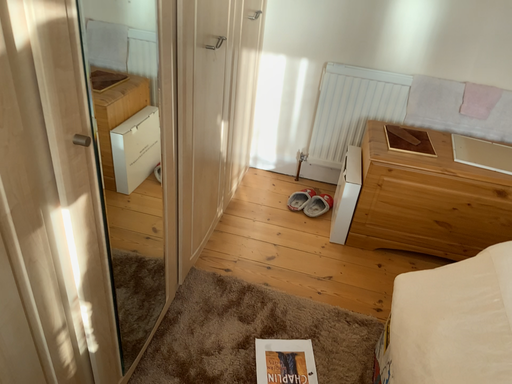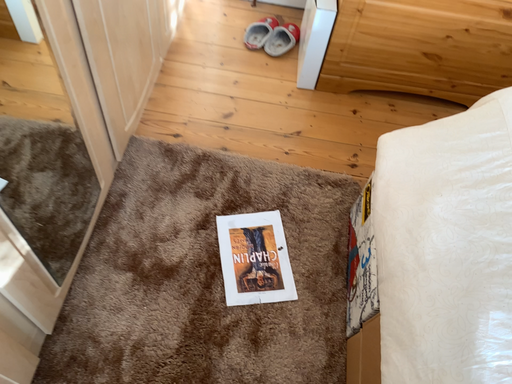
Question: Which way did the camera rotate in the video?

Choices:
 (A) rotated upward
 (B) rotated downward

Answer: (B)